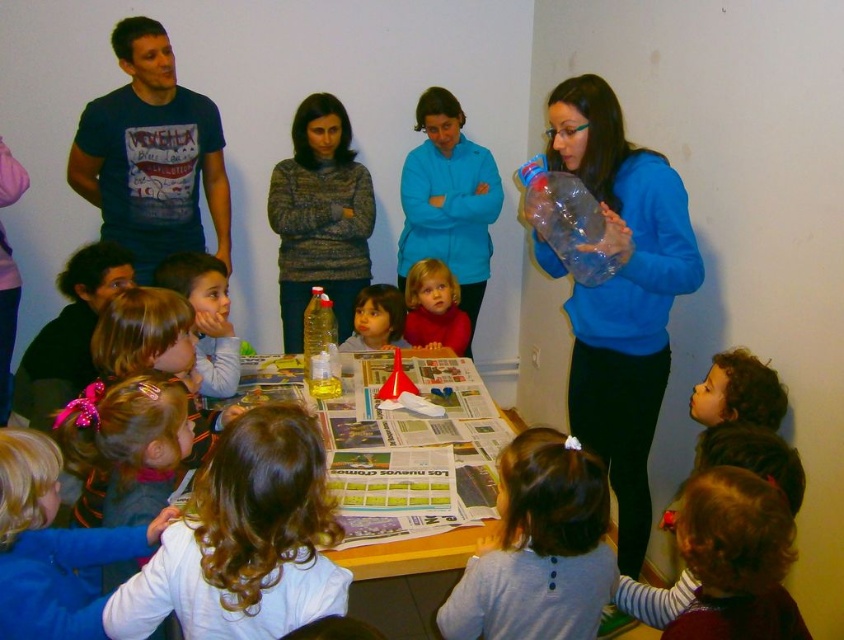
You are standing in the room and want to locate the woman leading the activity. Where is the woman standing relative to the white curly hair at center?

The white curly hair at center is located at point 0.844 on the x axis and 0.290 on the y axis, so the woman is standing at that position.

You are standing at the point labeled point [314,310] and want to move to the door located at the back of the room. There is an obstacle at point [751,508]. Can you walk directly towards the door without going around the obstacle?

Since point [751,508] is in front of point [314,310], walking directly towards the door would require passing in front of the obstacle at point [751,508]. Therefore, you cannot walk directly without going around the obstacle.

You are a photographer trying to capture a clear shot of the translucent plastic bottle at upper center without the blue matte sweater at upper right blocking it. From your current position, which direction should you move to ensure the sweater is no longer in front of the bottle?

To avoid the blue matte sweater at upper right blocking the view, move to the left side of the table. Since the sweater is in front of the bottle from your current position, shifting left would reposition you so the sweater is no longer obstructing the bottle.